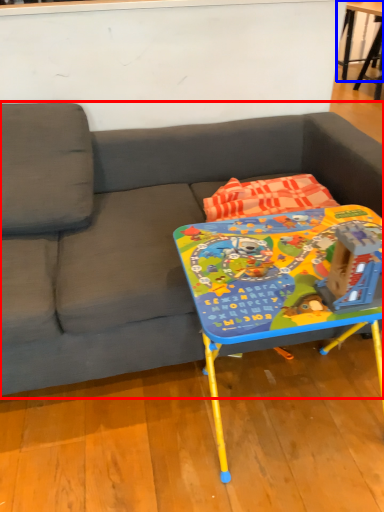
Question: Which object is closer to the camera taking this photo, studio couch (highlighted by a red box) or table (highlighted by a blue box)?

Choices:
 (A) studio couch
 (B) table

Answer: (A)